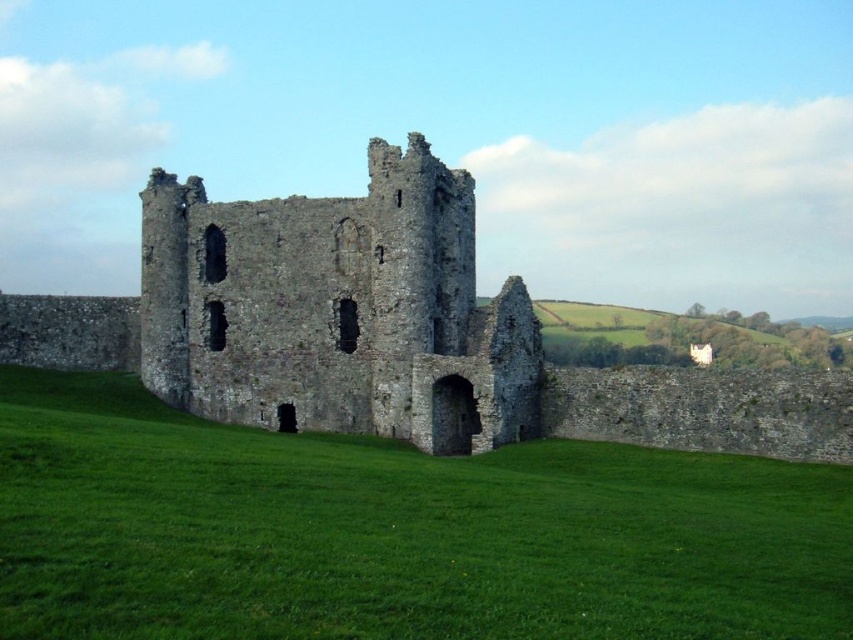
Is green grassy at center wider than stone castle at center?

Indeed, green grassy at center has a greater width compared to stone castle at center.

Is green grassy at center to the right of stone castle at center from the viewer's perspective?

In fact, green grassy at center is to the left of stone castle at center.

Is point (287, 556) closer to viewer compared to point (468, 348)?

Yes, it is.

I want to click on green grassy at center, so click(393, 532).